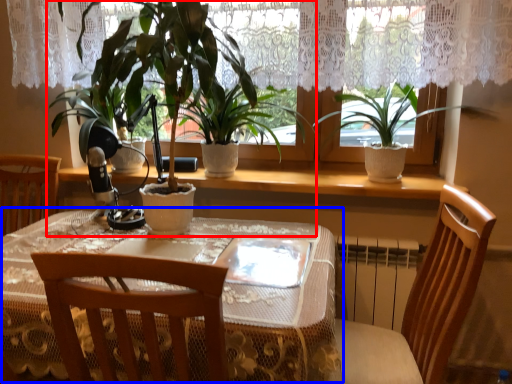
Question: Which object appears farthest to the camera in this image, houseplant (highlighted by a red box) or table (highlighted by a blue box)?

Choices:
 (A) houseplant
 (B) table

Answer: (A)